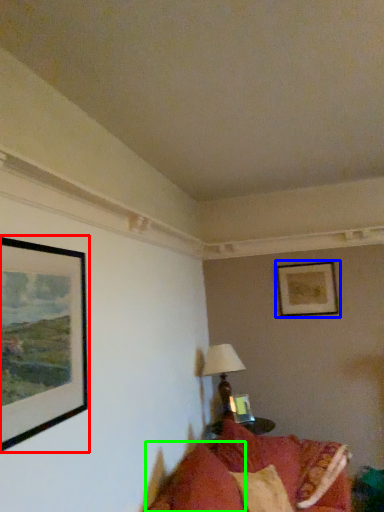
Question: Based on their relative distances, which object is nearer to picture frame (highlighted by a red box)? Choose from picture frame (highlighted by a blue box) and pillow (highlighted by a green box).

Choices:
 (A) picture frame
 (B) pillow

Answer: (B)